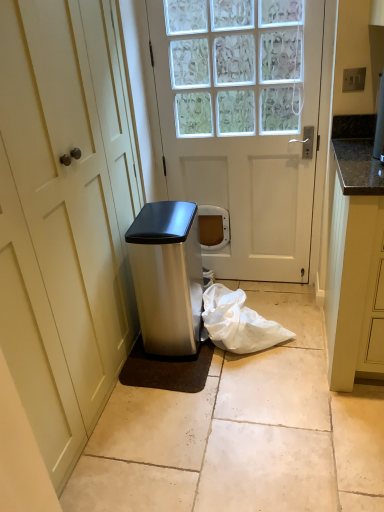
In order to face white matte door at center, the 1th door when ordered from left to right, should I rotate leftwards or rightwards?

To face it directly, rotate left by 16.811 degrees.

Locate an element on the screen. The width and height of the screenshot is (384, 512). granite countertop at right is located at coordinates (355, 265).

Identify the location of white matte door at center, positioned as the second door in left-to-right order. The height and width of the screenshot is (512, 384). (243, 124).

What are the coordinates of `satin silver trash can at lower left` in the screenshot? It's located at (167, 276).

Does white matte plastic bag at lower center have a smaller size compared to white matte door at center, the 1th door when ordered from left to right?

Yes.

Is white matte plastic bag at lower center not near white matte door at center, the 2th door from the right?

Actually, white matte plastic bag at lower center and white matte door at center, the 2th door from the right, are a little close together.

Who is more distant, white matte plastic bag at lower center or white matte door at center, the 1th door when ordered from left to right?

white matte plastic bag at lower center is further from the camera.

Is white matte plastic bag at lower center facing towards white matte door at center, the 1th door when ordered from left to right?

No.

Is white matte door at center, the 2th door from the right, taller than granite countertop at right?

Yes, white matte door at center, the 2th door from the right, is taller than granite countertop at right.

Looking at the image, does white matte door at center, the 2th door from the right, seem bigger or smaller compared to granite countertop at right?

Clearly, white matte door at center, the 2th door from the right, is larger in size than granite countertop at right.

Do you think white matte door at center, the 1th door when ordered from left to right, is within granite countertop at right, or outside of it?

white matte door at center, the 1th door when ordered from left to right, lies outside granite countertop at right.

What's the angular difference between white matte door at center, the 1th door when ordered from left to right, and white matte plastic bag at lower center's facing directions?

The facing directions of white matte door at center, the 1th door when ordered from left to right, and white matte plastic bag at lower center are 89.6 degrees apart.

Which object is more forward, white matte door at center, the 2th door from the right, or white matte plastic bag at lower center?

Positioned in front is white matte door at center, the 2th door from the right.

Are white matte door at center, the 1th door when ordered from left to right, and white matte plastic bag at lower center making contact?

white matte door at center, the 1th door when ordered from left to right, and white matte plastic bag at lower center are not in contact.

Between white matte door at center, the 2th door from the right, and white matte plastic bag at lower center, which one appears on the right side from the viewer's perspective?

Positioned to the right is white matte plastic bag at lower center.

Which of these two, white matte door at center, which is counted as the 1th door, starting from the right, or satin silver trash can at lower left, is thinner?

white matte door at center, which is counted as the 1th door, starting from the right, is thinner.

Which is nearer, (149, 15) or (138, 242)?

The point (138, 242) is in front.

From the image's perspective, between white matte door at center, positioned as the second door in left-to-right order, and satin silver trash can at lower left, who is located below?

satin silver trash can at lower left appears lower in the image.

Can you tell me how much white matte door at center, positioned as the second door in left-to-right order, and satin silver trash can at lower left differ in facing direction?

The angular difference between white matte door at center, positioned as the second door in left-to-right order, and satin silver trash can at lower left is 1.21 degrees.

Who is bigger, white matte door at center, positioned as the second door in left-to-right order, or granite countertop at right?

granite countertop at right is bigger.

Considering the relative positions of white matte door at center, which is counted as the 1th door, starting from the right, and granite countertop at right in the image provided, is white matte door at center, which is counted as the 1th door, starting from the right, behind granite countertop at right?

That is True.

Is white matte door at center, which is counted as the 1th door, starting from the right, turned away from granite countertop at right?

white matte door at center, which is counted as the 1th door, starting from the right, is not turned away from granite countertop at right.

Is white matte door at center, which is counted as the 1th door, starting from the right, thinner than granite countertop at right?

Yes.

Is satin silver trash can at lower left with white matte door at center, positioned as the second door in left-to-right order?

No, satin silver trash can at lower left is not beside white matte door at center, positioned as the second door in left-to-right order.

At what (x,y) coordinates should I click in order to perform the action: click on door on the right side of satin silver trash can at lower left. Please return your answer as a coordinate pair (x, y). This screenshot has width=384, height=512. Looking at the image, I should click on (243, 124).

From a real-world perspective, between satin silver trash can at lower left and white matte door at center, positioned as the second door in left-to-right order, who is vertically higher?

In real-world perspective, white matte door at center, positioned as the second door in left-to-right order, is above.

Is white matte door at center, positioned as the second door in left-to-right order, located within satin silver trash can at lower left?

No, white matte door at center, positioned as the second door in left-to-right order, is not surrounded by satin silver trash can at lower left.

Image resolution: width=384 pixels, height=512 pixels. What are the coordinates of `cabinetry located underneath the white matte door at center, which is counted as the 1th door, starting from the right (from a real-world perspective)` in the screenshot? It's located at (x=355, y=265).

Which object is thinner, granite countertop at right or white matte door at center, which is counted as the 1th door, starting from the right?

white matte door at center, which is counted as the 1th door, starting from the right.

From the picture: Measure the distance between granite countertop at right and white matte door at center, positioned as the second door in left-to-right order.

granite countertop at right and white matte door at center, positioned as the second door in left-to-right order, are 61.38 centimeters apart.

Would you say granite countertop at right is inside or outside white matte door at center, which is counted as the 1th door, starting from the right?

granite countertop at right lies outside white matte door at center, which is counted as the 1th door, starting from the right.

Where is `plastic bag behind the white matte door at center, the 2th door from the right`? The height and width of the screenshot is (512, 384). plastic bag behind the white matte door at center, the 2th door from the right is located at coordinates (238, 322).

Locate an element on the screen. The height and width of the screenshot is (512, 384). door in front of the granite countertop at right is located at coordinates (65, 216).

Based on their spatial positions, is white matte door at center, which is counted as the 1th door, starting from the right, or white matte plastic bag at lower center closer to satin silver trash can at lower left?

white matte plastic bag at lower center lies closer to satin silver trash can at lower left than the other object.

Consider the image. Based on their spatial positions, is white matte door at center, which is counted as the 1th door, starting from the right, or satin silver trash can at lower left further from white matte door at center, the 1th door when ordered from left to right?

The object further to white matte door at center, the 1th door when ordered from left to right, is white matte door at center, which is counted as the 1th door, starting from the right.

Estimate the real-world distances between objects in this image. Which object is further from satin silver trash can at lower left, white matte door at center, positioned as the second door in left-to-right order, or granite countertop at right?

The object further to satin silver trash can at lower left is granite countertop at right.

From the image, which object appears to be farther from satin silver trash can at lower left, granite countertop at right or white matte plastic bag at lower center?

granite countertop at right is positioned further to the anchor satin silver trash can at lower left.

Considering their positions, is white matte door at center, the 2th door from the right, positioned closer to satin silver trash can at lower left than white matte plastic bag at lower center?

white matte plastic bag at lower center is closer to satin silver trash can at lower left.

Based on their spatial positions, is white matte plastic bag at lower center or granite countertop at right closer to white matte door at center, the 1th door when ordered from left to right?

white matte plastic bag at lower center is closer to white matte door at center, the 1th door when ordered from left to right.

Looking at the image, which one is located further to satin silver trash can at lower left, white matte door at center, the 2th door from the right, or white matte door at center, which is counted as the 1th door, starting from the right?

Among the two, white matte door at center, which is counted as the 1th door, starting from the right, is located further to satin silver trash can at lower left.

Estimate the real-world distances between objects in this image. Which object is further from white matte door at center, positioned as the second door in left-to-right order, granite countertop at right or white matte plastic bag at lower center?

white matte plastic bag at lower center is positioned further to the anchor white matte door at center, positioned as the second door in left-to-right order.

This screenshot has height=512, width=384. In order to click on appliance located between white matte door at center, the 1th door when ordered from left to right, and granite countertop at right in the left-right direction in this screenshot , I will do `click(167, 276)`.

This screenshot has height=512, width=384. I want to click on door located between satin silver trash can at lower left and granite countertop at right in the left-right direction, so click(243, 124).

I want to click on appliance positioned between white matte door at center, the 2th door from the right, and white matte door at center, which is counted as the 1th door, starting from the right, from near to far, so click(167, 276).

You are a GUI agent. You are given a task and a screenshot of the screen. Output one action in this format:
    pyautogui.click(x=<x>, y=<y>)
    Task: Click on the door located between white matte door at center, the 2th door from the right, and white matte plastic bag at lower center in the depth direction
    
    Given the screenshot: What is the action you would take?
    pyautogui.click(x=243, y=124)